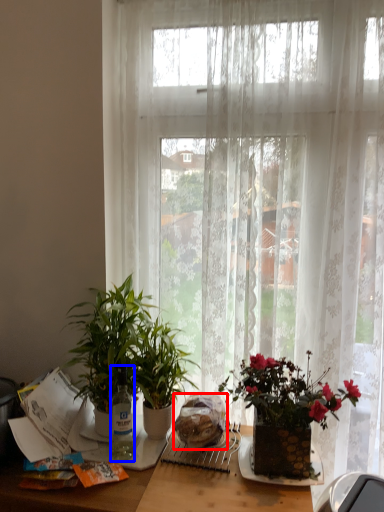
Question: Which object is closer to the camera taking this photo, food (highlighted by a red box) or bottle (highlighted by a blue box)?

Choices:
 (A) food
 (B) bottle

Answer: (A)